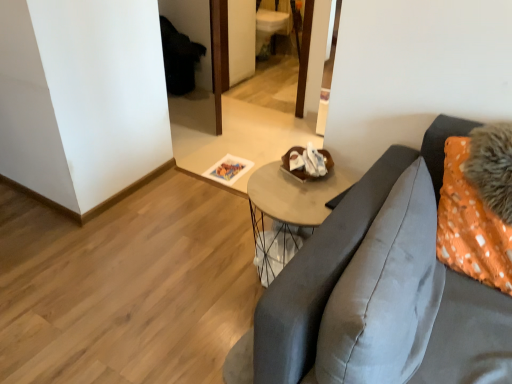
Question: Does wooden round table at center appear on the right side of wooden mirror at center?

Choices:
 (A) yes
 (B) no

Answer: (A)

Question: From a real-world perspective, is wooden round table at center physically below wooden mirror at center?

Choices:
 (A) yes
 (B) no

Answer: (A)

Question: Is wooden round table at center positioned in front of wooden mirror at center?

Choices:
 (A) yes
 (B) no

Answer: (A)

Question: Is wooden round table at center wider than wooden mirror at center?

Choices:
 (A) no
 (B) yes

Answer: (A)

Question: Is wooden round table at center shorter than wooden mirror at center?

Choices:
 (A) yes
 (B) no

Answer: (A)

Question: Choose the correct answer: Is wooden mirror at center inside satin gray pillow at right or outside it?

Choices:
 (A) outside
 (B) inside

Answer: (A)

Question: Is point (205, 99) positioned closer to the camera than point (373, 292)?

Choices:
 (A) farther
 (B) closer

Answer: (A)

Question: In terms of width, does wooden mirror at center look wider or thinner when compared to satin gray pillow at right?

Choices:
 (A) wide
 (B) thin

Answer: (A)

Question: In terms of size, does wooden mirror at center appear bigger or smaller than satin gray pillow at right?

Choices:
 (A) big
 (B) small

Answer: (A)

Question: Relative to satin gray pillow at right, is wooden round table at center in front or behind?

Choices:
 (A) behind
 (B) front

Answer: (A)

Question: From a real-world perspective, is wooden round table at center positioned above or below satin gray pillow at right?

Choices:
 (A) below
 (B) above

Answer: (A)

Question: Visually, is wooden round table at center positioned to the left or to the right of satin gray pillow at right?

Choices:
 (A) right
 (B) left

Answer: (B)

Question: In terms of height, does wooden round table at center look taller or shorter compared to satin gray pillow at right?

Choices:
 (A) short
 (B) tall

Answer: (B)

Question: Is satin gray pillow at right taller or shorter than wooden round table at center?

Choices:
 (A) short
 (B) tall

Answer: (A)

Question: Is satin gray pillow at right spatially inside wooden round table at center, or outside of it?

Choices:
 (A) inside
 (B) outside

Answer: (B)